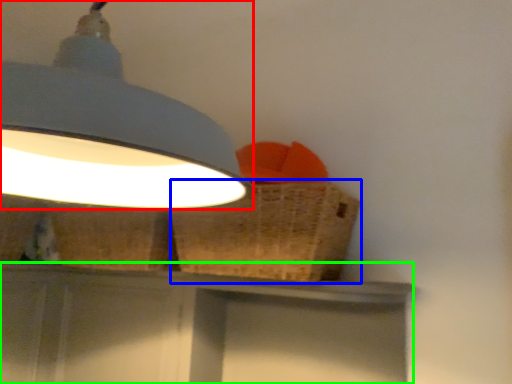
Question: Which is nearer to the lamp (highlighted by a red box)? basket (highlighted by a blue box) or vanity (highlighted by a green box).

Choices:
 (A) basket
 (B) vanity

Answer: (A)